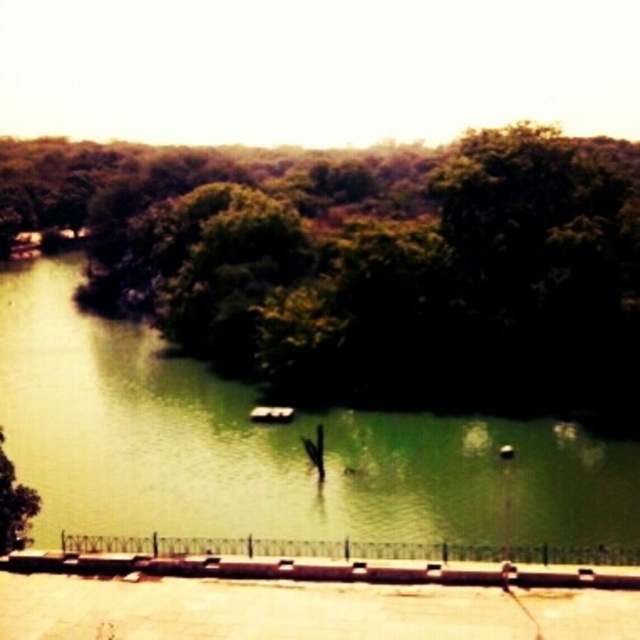
Does green leafy tree at center have a larger size compared to green water at center?

Indeed, green leafy tree at center has a larger size compared to green water at center.

Who is positioned more to the left, green leafy tree at center or green water at center?

Positioned to the left is green water at center.

Measure the distance between green leafy tree at center and camera.

green leafy tree at center and camera are 57.40 meters apart from each other.

This screenshot has width=640, height=640. Identify the location of green leafy tree at center. (365, 262).